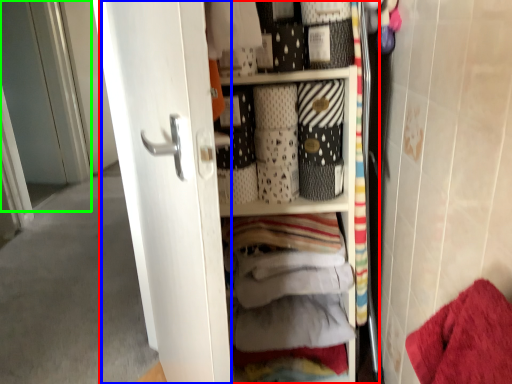
Question: Which object is positioned closest to dresser (highlighted by a red box)? Select from screen door (highlighted by a blue box) and screen door (highlighted by a green box).

Choices:
 (A) screen door
 (B) screen door

Answer: (A)